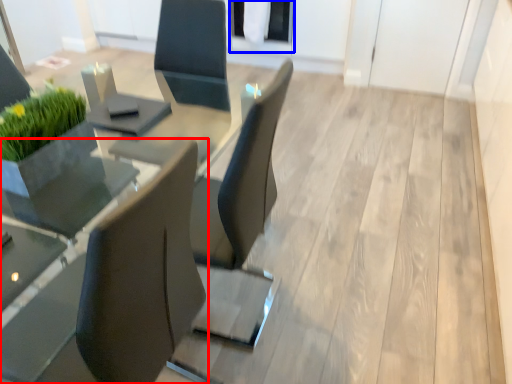
Question: Which of the following is the farthest to the observer, chair (highlighted by a red box) or glass door (highlighted by a blue box)?

Choices:
 (A) chair
 (B) glass door

Answer: (B)